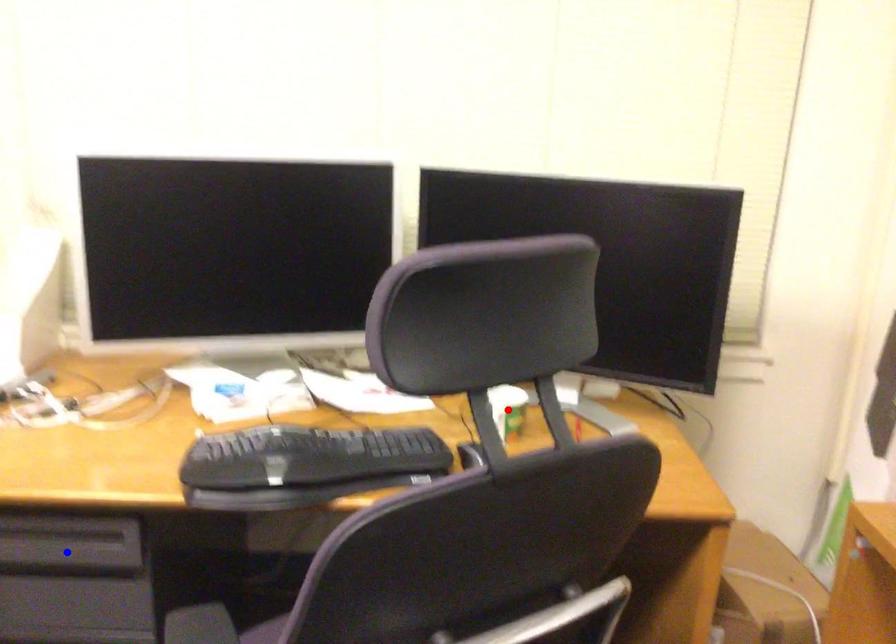
Question: Which of the two points in the image is closer to the camera?

Choices:
 (A) Blue point is closer.
 (B) Red point is closer.

Answer: (A)